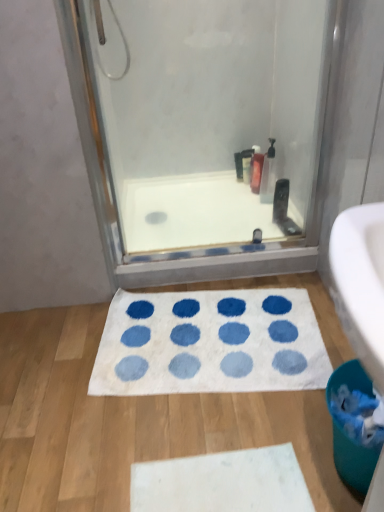
This screenshot has height=512, width=384. What are the coordinates of `free space in front of white soft bath mat at center` in the screenshot? It's located at point(198,439).